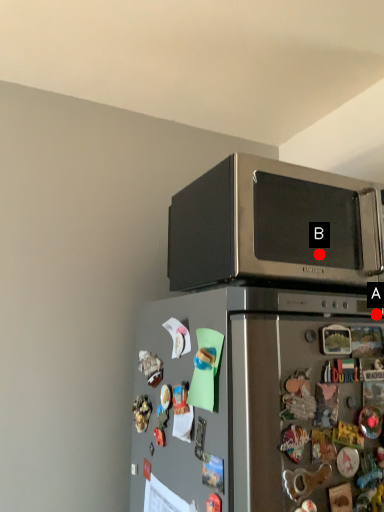
Question: Two points are circled on the image, labeled by A and B beside each circle. Among these points, which one is nearest to the camera?

Choices:
 (A) A is closer
 (B) B is closer

Answer: (A)